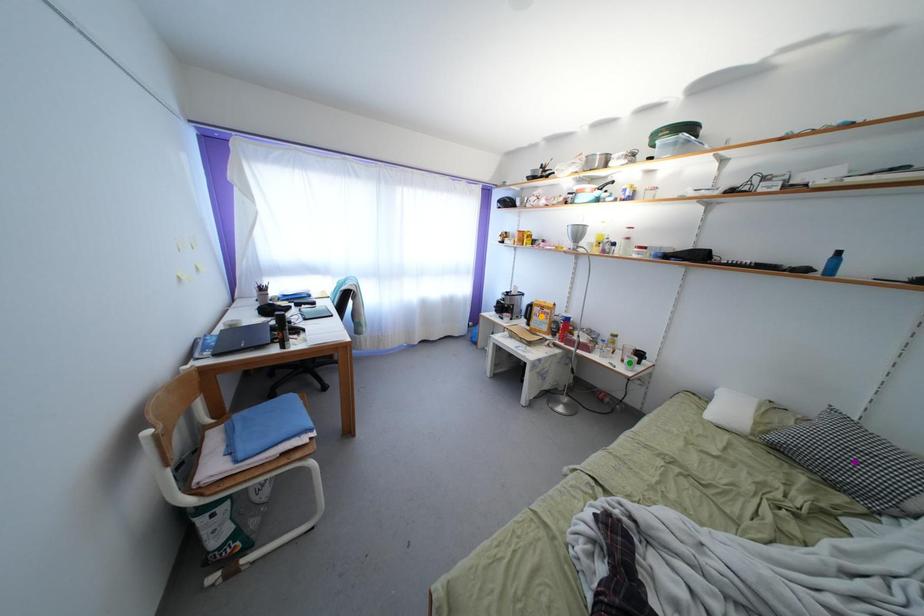
Order these from nearest to farthest:
A) green point
B) purple point
C) orange point

1. purple point
2. green point
3. orange point